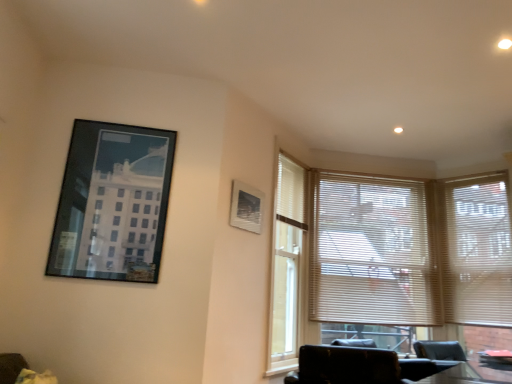
Where is `vacant point above beige/wooden blinds at center, which appears as the 1th window blind when viewed from the left (from a real-world perspective)`? The height and width of the screenshot is (384, 512). vacant point above beige/wooden blinds at center, which appears as the 1th window blind when viewed from the left (from a real-world perspective) is located at coordinates click(361, 166).